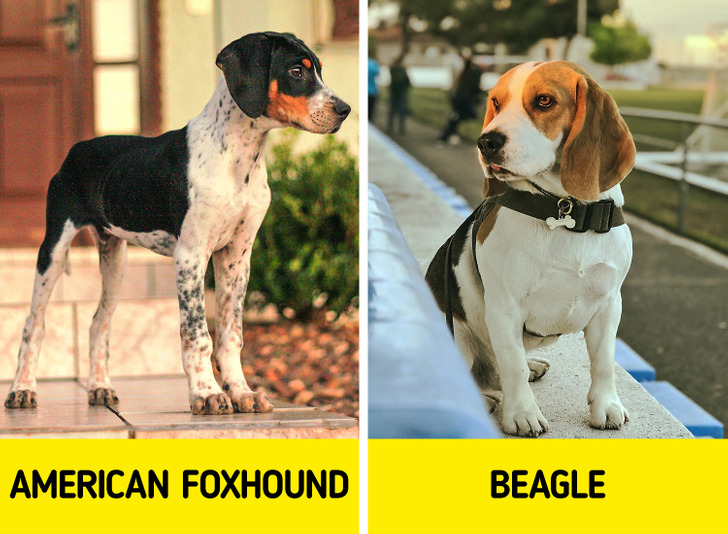
Identify the location of door. This screenshot has width=728, height=534. (31, 81).